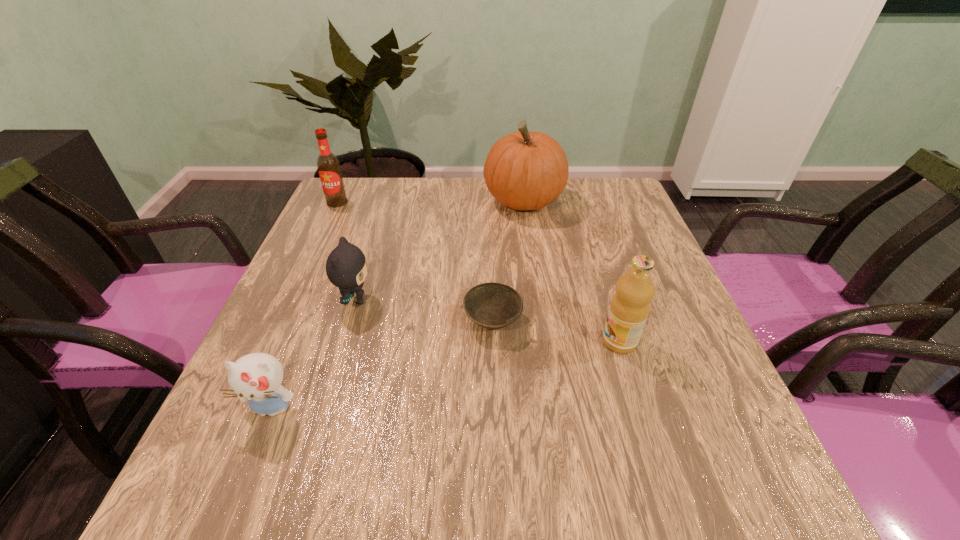
Locate an element on the screen. Image resolution: width=960 pixels, height=540 pixels. vacant area that lies between the left kitten and the pumpkin is located at coordinates (397, 305).

The height and width of the screenshot is (540, 960). What are the coordinates of `free spot between the olive oil and the pumpkin` in the screenshot? It's located at (571, 271).

Locate an element on the screen. free spot between the pumpkin and the olive oil is located at coordinates (571, 271).

Identify the location of vacant area between the shortest object and the fourth object from right to left. Image resolution: width=960 pixels, height=540 pixels. (424, 310).

The image size is (960, 540). What are the coordinates of `free point between the pumpkin and the beer bottle` in the screenshot? It's located at (430, 201).

You are a GUI agent. You are given a task and a screenshot of the screen. Output one action in this format:
    pyautogui.click(x=<x>, y=<y>)
    Task: Click on the vacant area that lies between the beer bottle and the shortest object
    The image size is (960, 540).
    Given the screenshot: What is the action you would take?
    pyautogui.click(x=415, y=261)

Locate an element on the screen. The height and width of the screenshot is (540, 960). vacant space that's between the pumpkin and the shortest object is located at coordinates 508,261.

In order to click on free point between the beer bottle and the pumpkin in this screenshot , I will do `click(430, 201)`.

The height and width of the screenshot is (540, 960). I want to click on free spot between the pumpkin and the olive oil, so click(x=571, y=271).

Where is `object that is the fourth closest to the beer bottle`? Image resolution: width=960 pixels, height=540 pixels. object that is the fourth closest to the beer bottle is located at coordinates (257, 377).